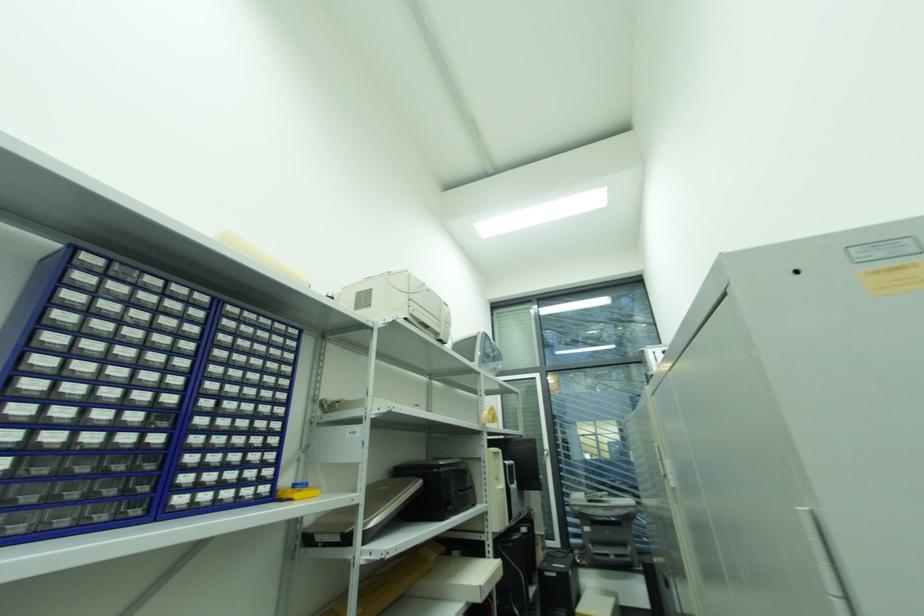
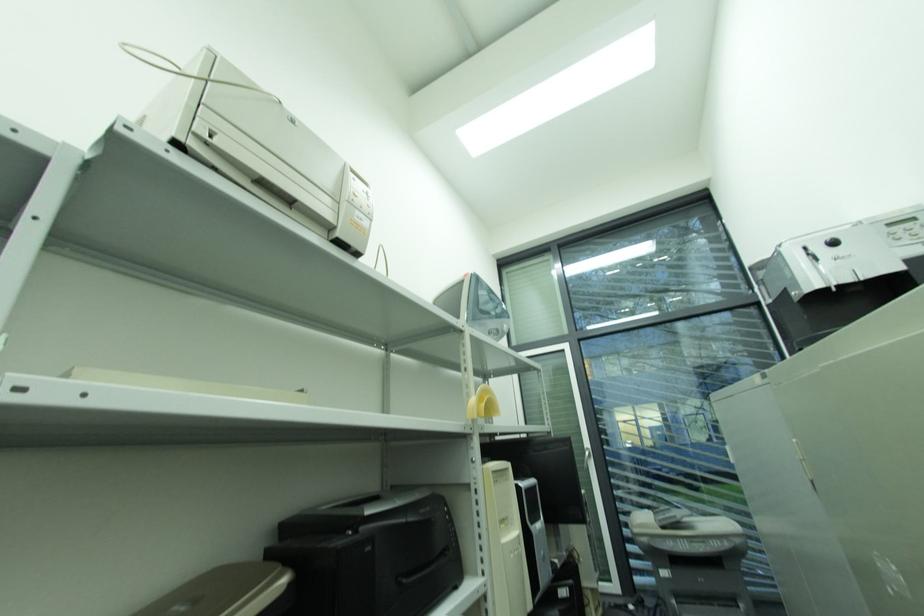
Question: In a continuous first-person perspective shot, in which direction is the camera moving?

Choices:
 (A) Left
 (B) Right
 (C) Forward
 (D) Backward

Answer: (C)